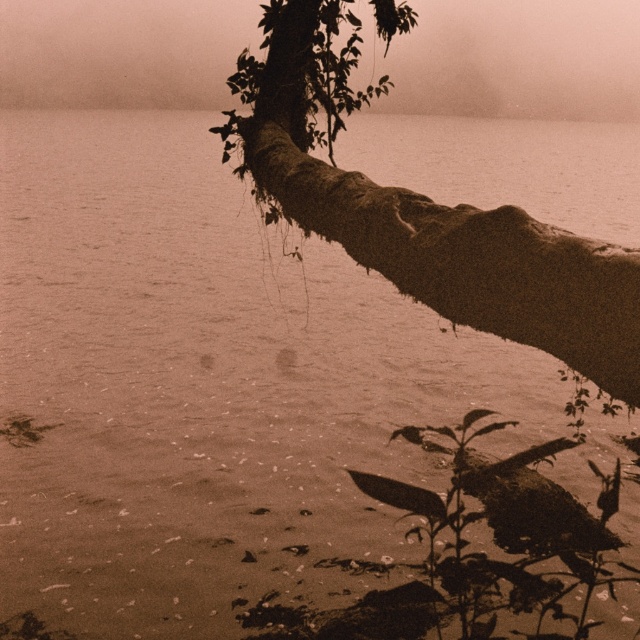
Question: Observing the image, what is the correct spatial positioning of rough bark branch at upper right in reference to foggy mist at upper center?

Choices:
 (A) above
 (B) below

Answer: (B)

Question: Can you confirm if rough bark branch at upper right is thinner than foggy mist at upper center?

Choices:
 (A) no
 (B) yes

Answer: (B)

Question: Is rough bark branch at upper right closer to the viewer compared to foggy mist at upper center?

Choices:
 (A) yes
 (B) no

Answer: (A)